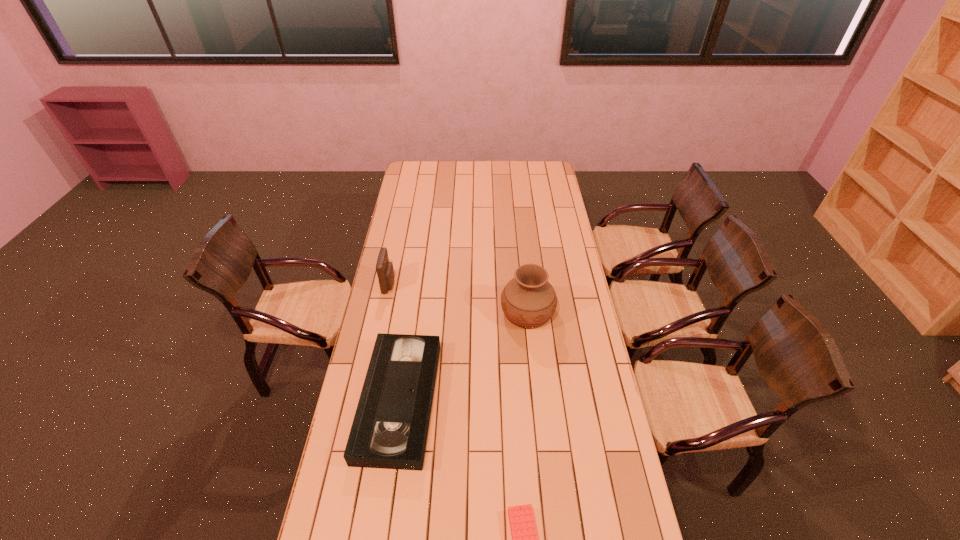
This screenshot has width=960, height=540. I want to click on the tallest object, so click(528, 300).

Locate an element on the screen. This screenshot has width=960, height=540. the third shortest object is located at coordinates (385, 272).

Where is `the third farthest object`? This screenshot has width=960, height=540. the third farthest object is located at coordinates tap(390, 427).

Image resolution: width=960 pixels, height=540 pixels. Identify the location of the second shortest object. (390, 427).

Locate an element on the screen. The image size is (960, 540). free location located 0.350m on the left of the tallest object is located at coordinates (419, 312).

Locate an element on the screen. Image resolution: width=960 pixels, height=540 pixels. blank area located 0.190m with an open flap on the third shortest object is located at coordinates (437, 284).

Identify the location of blank area located 0.060m on the front of the videotape. The image size is (960, 540). (386, 490).

At what (x,y) coordinates should I click in order to perform the action: click on pouch present at the left edge. Please return your answer as a coordinate pair (x, y). This screenshot has height=540, width=960. Looking at the image, I should click on (385, 272).

At what (x,y) coordinates should I click in order to perform the action: click on videotape present at the left edge. Please return your answer as a coordinate pair (x, y). The image size is (960, 540). Looking at the image, I should click on (390, 427).

Identify the location of object at the right edge. The width and height of the screenshot is (960, 540). (528, 300).